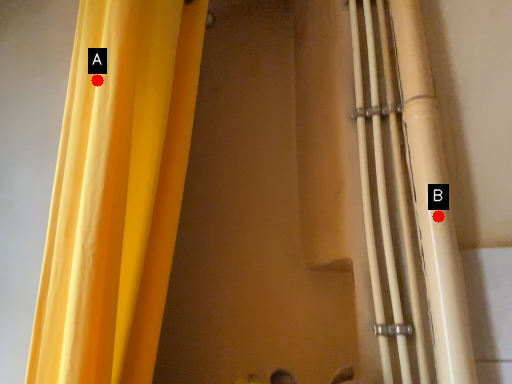
Question: Two points are circled on the image, labeled by A and B beside each circle. Which point is farther from the camera taking this photo?

Choices:
 (A) A is further
 (B) B is further

Answer: (B)